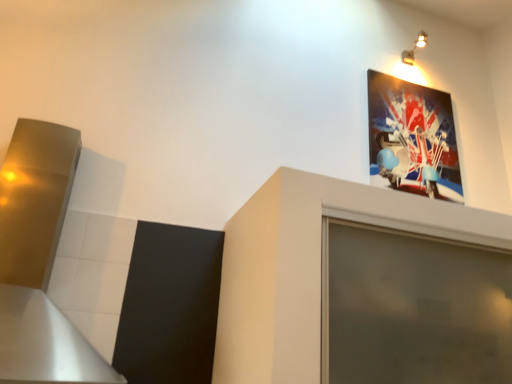
Question: Can we say matte plastic picture frame at upper right lies outside metallic spotlights at upper right?

Choices:
 (A) no
 (B) yes

Answer: (B)

Question: Is matte plastic picture frame at upper right thinner than metallic spotlights at upper right?

Choices:
 (A) no
 (B) yes

Answer: (B)

Question: Is matte plastic picture frame at upper right taller than metallic spotlights at upper right?

Choices:
 (A) yes
 (B) no

Answer: (A)

Question: Are matte plastic picture frame at upper right and metallic spotlights at upper right located far from each other?

Choices:
 (A) no
 (B) yes

Answer: (A)

Question: Can you confirm if matte plastic picture frame at upper right is shorter than metallic spotlights at upper right?

Choices:
 (A) yes
 (B) no

Answer: (B)

Question: From the image's perspective, would you say matte plastic picture frame at upper right is shown under metallic spotlights at upper right?

Choices:
 (A) no
 (B) yes

Answer: (B)

Question: From the image's perspective, is brushed metal exhaust hood at left located above matte plastic picture frame at upper right?

Choices:
 (A) no
 (B) yes

Answer: (A)

Question: From a real-world perspective, is brushed metal exhaust hood at left physically below matte plastic picture frame at upper right?

Choices:
 (A) yes
 (B) no

Answer: (A)

Question: Considering the relative positions of brushed metal exhaust hood at left and matte plastic picture frame at upper right in the image provided, is brushed metal exhaust hood at left behind matte plastic picture frame at upper right?

Choices:
 (A) no
 (B) yes

Answer: (A)

Question: Does brushed metal exhaust hood at left have a lesser height compared to matte plastic picture frame at upper right?

Choices:
 (A) no
 (B) yes

Answer: (A)

Question: Can you confirm if brushed metal exhaust hood at left is positioned to the left of matte plastic picture frame at upper right?

Choices:
 (A) no
 (B) yes

Answer: (B)

Question: From the image's perspective, is brushed metal exhaust hood at left below matte plastic picture frame at upper right?

Choices:
 (A) no
 (B) yes

Answer: (B)

Question: From a real-world perspective, is metallic spotlights at upper right located beneath brushed metal exhaust hood at left?

Choices:
 (A) no
 (B) yes

Answer: (A)